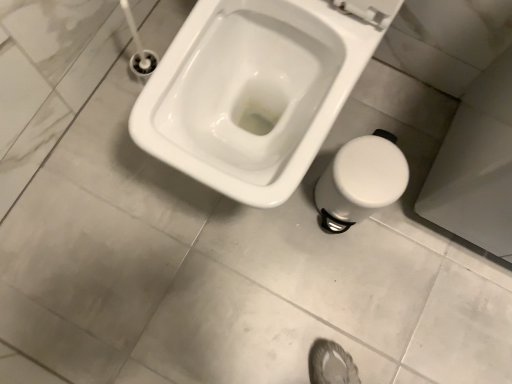
Where is `free point in front of white glossy toilet at center`? Image resolution: width=512 pixels, height=384 pixels. free point in front of white glossy toilet at center is located at coordinates [220, 289].